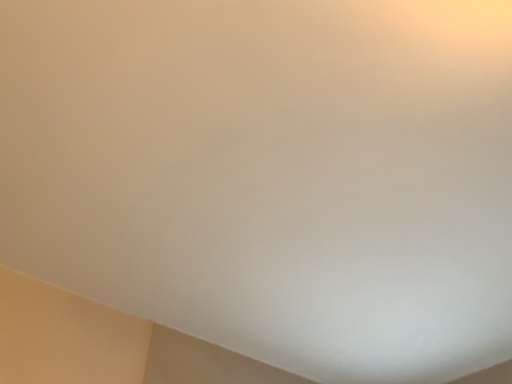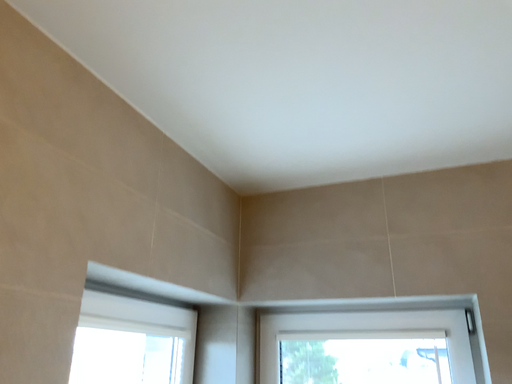
Question: How did the camera likely rotate when shooting the video?

Choices:
 (A) rotated downward
 (B) rotated upward

Answer: (A)